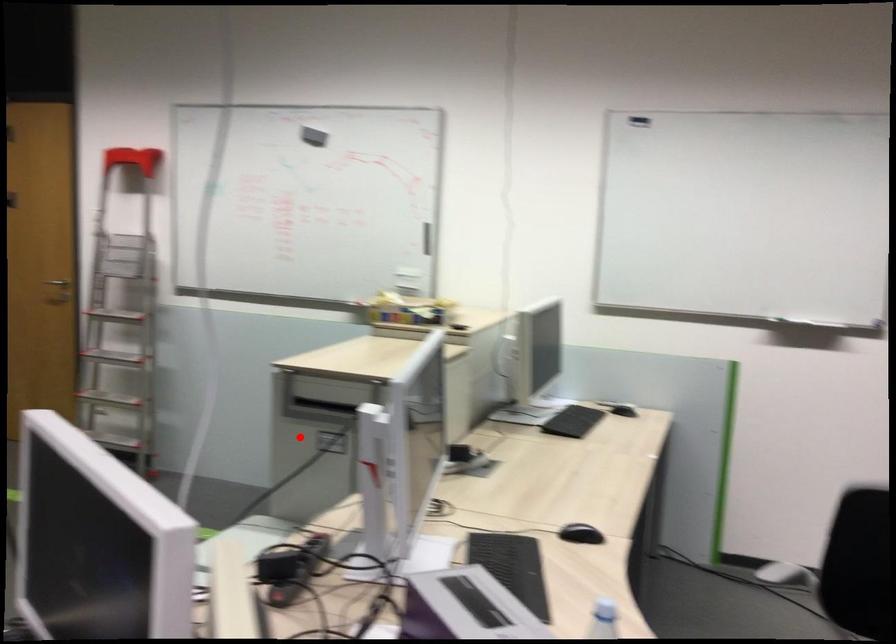
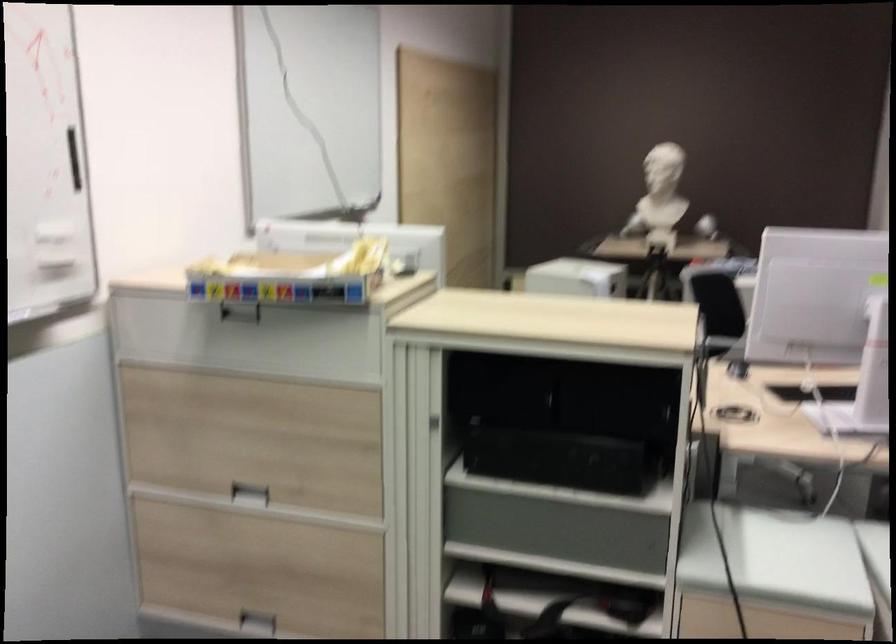
Question: I am providing you with two images of the same scene from different viewpoints. In image1, a red point is highlighted. Considering the same 3D point in image2, which of the following is correct?

Choices:
 (A) It is closer
 (B) It is farther

Answer: (A)